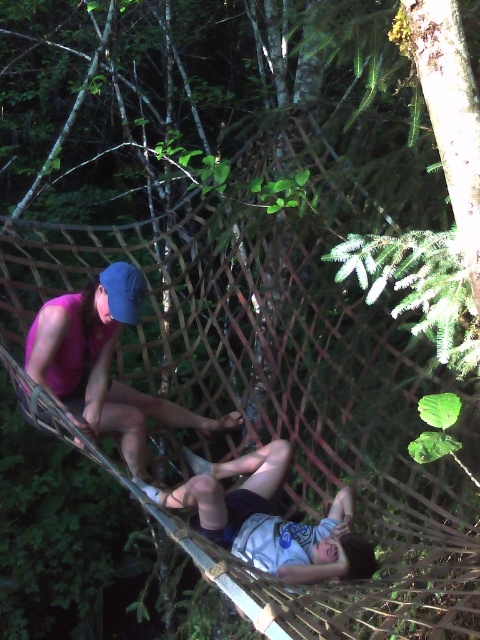
You are a photographer planning to take a closeup shot of the matte pink shorts at center and the white cotton shirt at center. Which object should you zoom in on if you want to capture more details of the larger one?

The matte pink shorts at center is bigger than the white cotton shirt at center, so you should zoom in on the matte pink shorts at center to capture more details of the larger one.

Based on the photo, you are a photographer standing in front of the hammock. You want to take a photo of the matte pink shorts at center and the white cotton shirt at center. Which object will appear closer to the camera in the photo?

The matte pink shorts at center will appear closer to the camera because the white cotton shirt at center is behind it.

Consider the image. You are a photographer trying to capture a closeup shot of the matte pink shorts at center and the white cotton shirt at center. Based on their positions, which one is closer to the camera?

The matte pink shorts at center is above the white cotton shirt at center, so the matte pink shorts at center is closer to the camera.